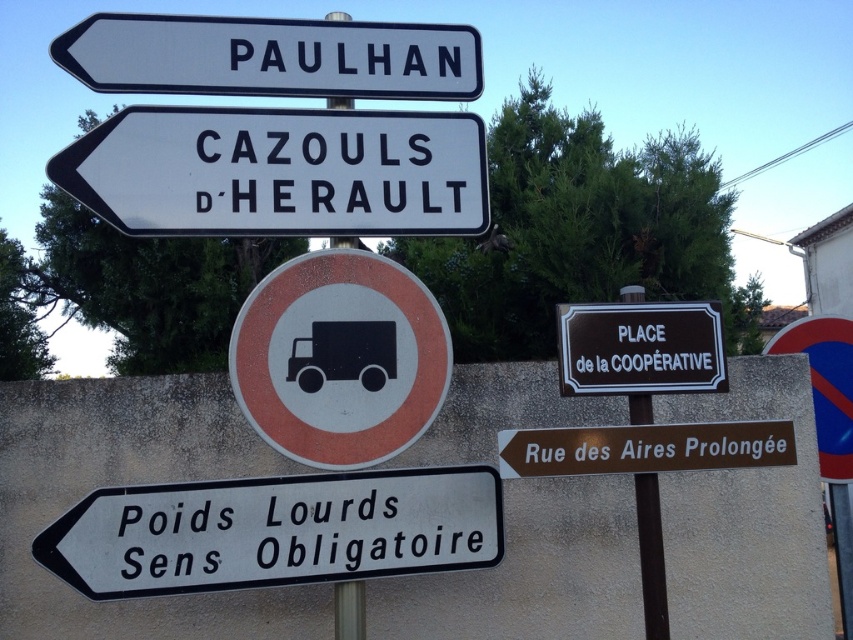
Question: Among these objects, which one is nearest to the camera?

Choices:
 (A) brown metallic sign at lower right
 (B) white paper truck at center
 (C) metallic pole at center

Answer: (A)

Question: Does white paper truck at center have a smaller size compared to brown metallic sign at lower right?

Choices:
 (A) yes
 (B) no

Answer: (B)

Question: Among these points, which one is farthest from the camera?

Choices:
 (A) (434, 483)
 (B) (351, 241)
 (C) (567, 316)
 (D) (627, 451)

Answer: (B)

Question: Is white plastic sign at upper center smaller than brown wooden sign at center?

Choices:
 (A) no
 (B) yes

Answer: (A)

Question: Where is white plastic sign at lower left located in relation to white paper truck at center in the image?

Choices:
 (A) left
 (B) right

Answer: (A)

Question: Which point appears farthest from the camera in this image?

Choices:
 (A) click(325, 44)
 (B) click(395, 227)

Answer: (A)